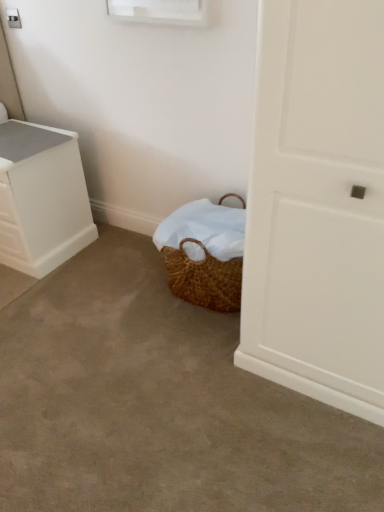
Question: Considering the positions of brown woven basket at lower center and white plastic chest of drawers at left in the image, is brown woven basket at lower center bigger or smaller than white plastic chest of drawers at left?

Choices:
 (A) small
 (B) big

Answer: (B)

Question: Does point (8, 350) appear closer or farther from the camera than point (1, 238)?

Choices:
 (A) closer
 (B) farther

Answer: (A)

Question: Relative to white plastic chest of drawers at left, is brown woven basket at lower center in front or behind?

Choices:
 (A) front
 (B) behind

Answer: (A)

Question: Is white plastic chest of drawers at left bigger or smaller than brown woven basket at lower center?

Choices:
 (A) big
 (B) small

Answer: (B)

Question: Is white plastic chest of drawers at left in front of or behind brown woven basket at lower center in the image?

Choices:
 (A) behind
 (B) front

Answer: (A)

Question: From the image's perspective, is white plastic chest of drawers at left positioned above or below brown woven basket at lower center?

Choices:
 (A) below
 (B) above

Answer: (B)

Question: Is white plastic chest of drawers at left inside or outside of brown woven basket at lower center?

Choices:
 (A) inside
 (B) outside

Answer: (B)